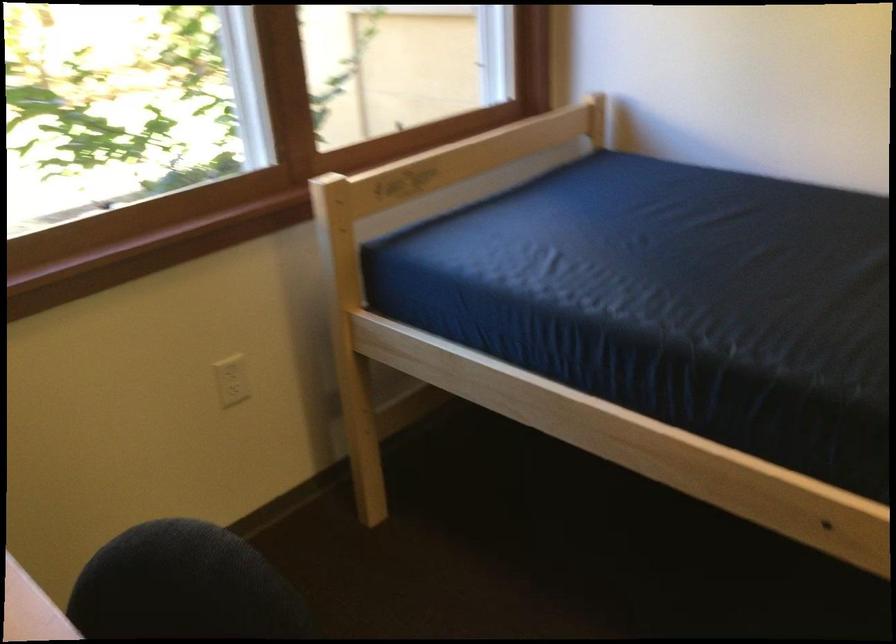
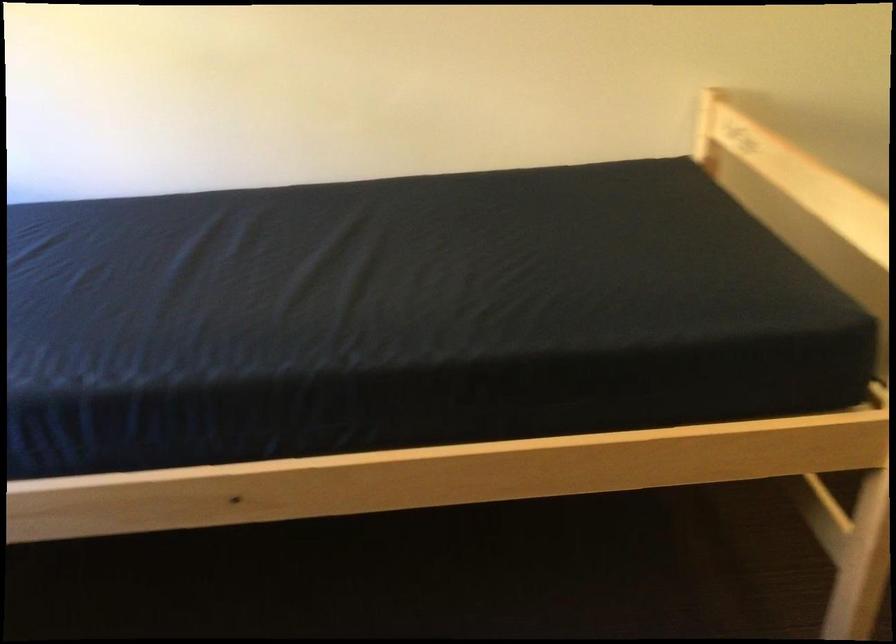
Question: How did the camera likely rotate?

Choices:
 (A) Left
 (B) Right
 (C) Up
 (D) Down

Answer: (B)